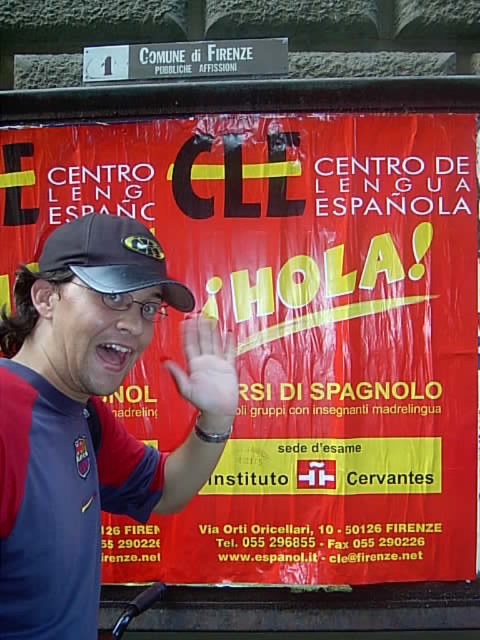
The image size is (480, 640). I want to click on red vinyl banner at center, so click(298, 330).

Between red vinyl banner at center and dark blue jersey at center, which one is positioned higher?

red vinyl banner at center is above.

Is point (243, 131) positioned in front of point (14, 604)?

No, it is behind (14, 604).

Identify the location of red vinyl banner at center. This screenshot has width=480, height=640. (298, 330).

Who is taller, dark blue jersey at center or matte black cap at center?

dark blue jersey at center is taller.

Between point (54, 508) and point (139, 273), which one is positioned behind?

The point (139, 273) is more distant.

What are the coordinates of `dark blue jersey at center` in the screenshot? It's located at (91, 417).

How much distance is there between matte black cap at center and skinny white hand at center?

A distance of 10.64 inches exists between matte black cap at center and skinny white hand at center.

Where is `matte black cap at center`? The width and height of the screenshot is (480, 640). matte black cap at center is located at coordinates (111, 257).

Which is in front, point (156, 256) or point (228, 426)?

Point (156, 256) is more forward.

Where is `matte black cap at center`? This screenshot has height=640, width=480. matte black cap at center is located at coordinates (111, 257).